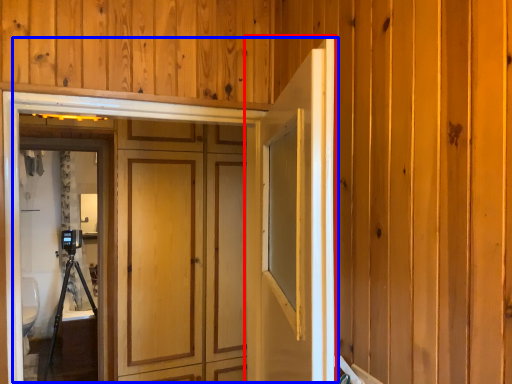
Question: Which object is further to the camera taking this photo, door (highlighted by a red box) or door (highlighted by a blue box)?

Choices:
 (A) door
 (B) door

Answer: (B)